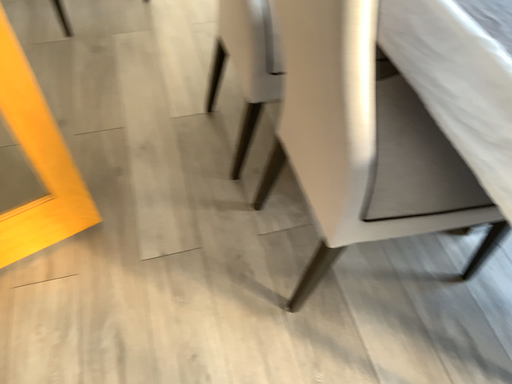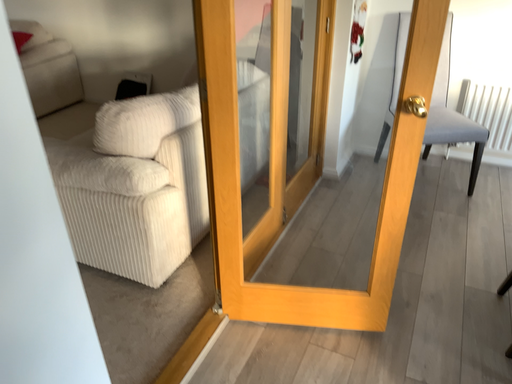
Question: Which way did the camera rotate in the video?

Choices:
 (A) rotated downward
 (B) rotated upward

Answer: (B)